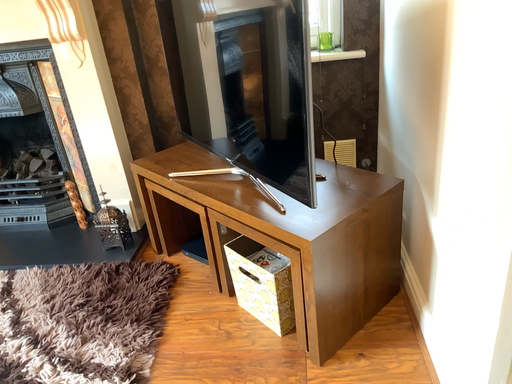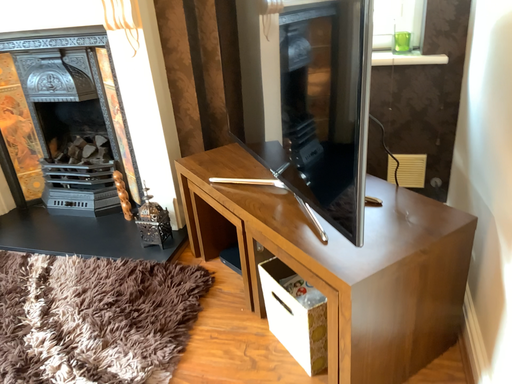
Question: Which way did the camera rotate in the video?

Choices:
 (A) rotated left
 (B) rotated right

Answer: (A)